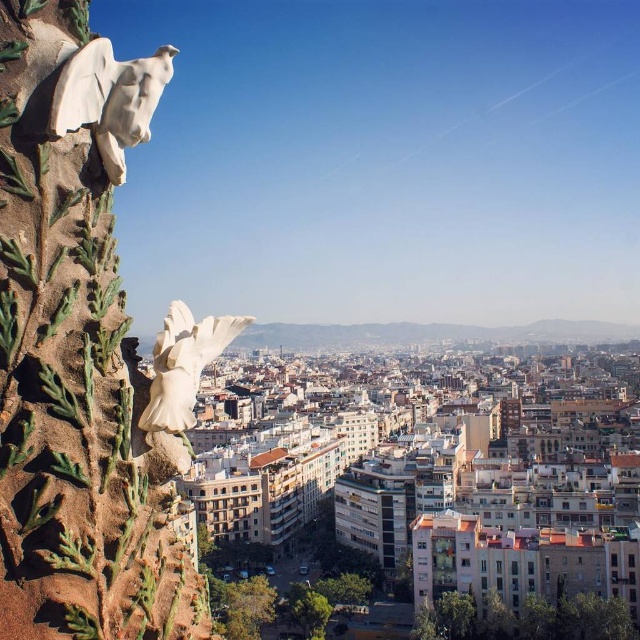
Does white stone eagle at upper left come behind white glossy bird at upper left?

No, white stone eagle at upper left is in front of white glossy bird at upper left.

Is white stone eagle at upper left to the right of white glossy bird at upper left from the viewer's perspective?

Incorrect, white stone eagle at upper left is not on the right side of white glossy bird at upper left.

Is point (112, 116) positioned in front of point (184, 406)?

Yes, point (112, 116) is in front of point (184, 406).

Identify the location of white stone eagle at upper left. The image size is (640, 640). (109, 99).